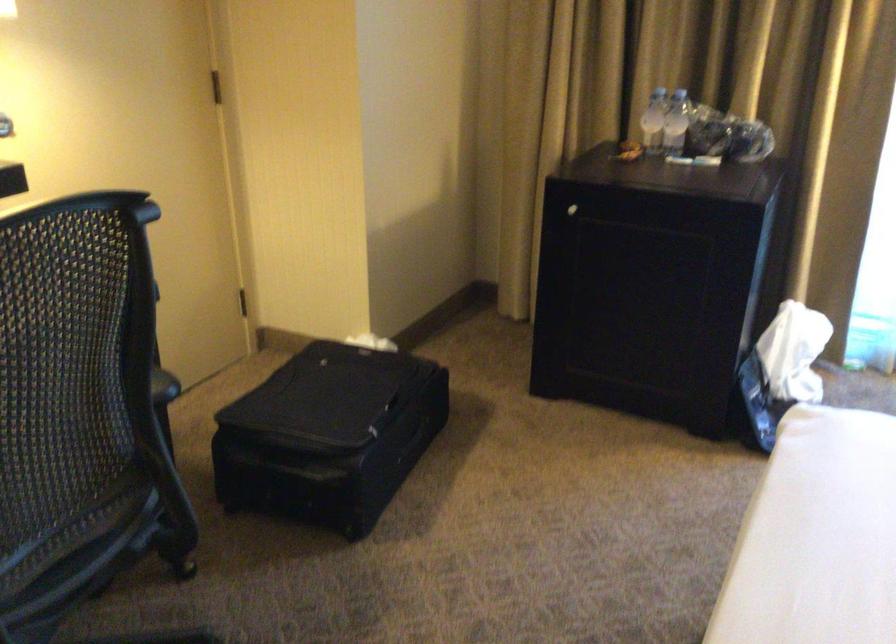
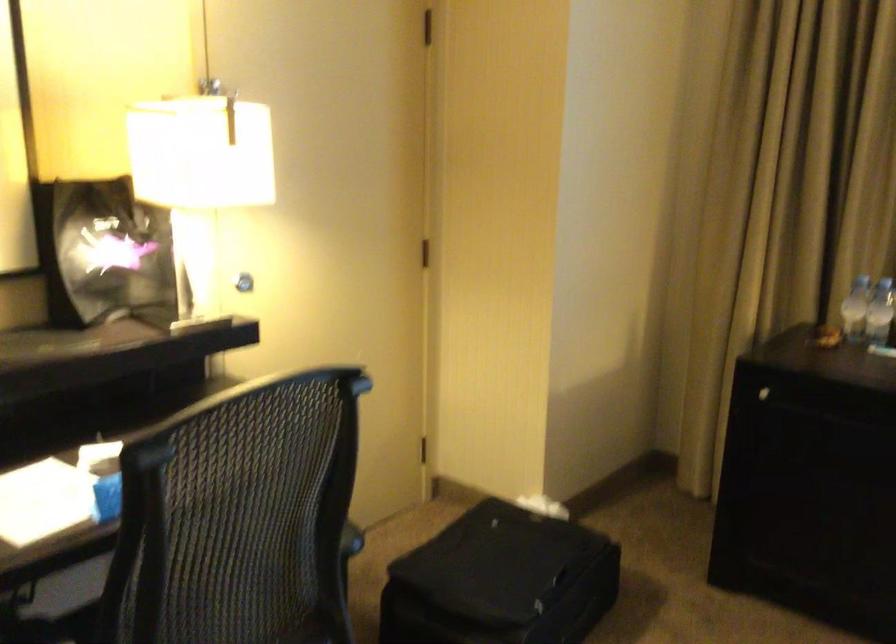
In a continuous first-person perspective shot, in which direction is the camera moving?

The movement direction of the cameraman is right, backward.